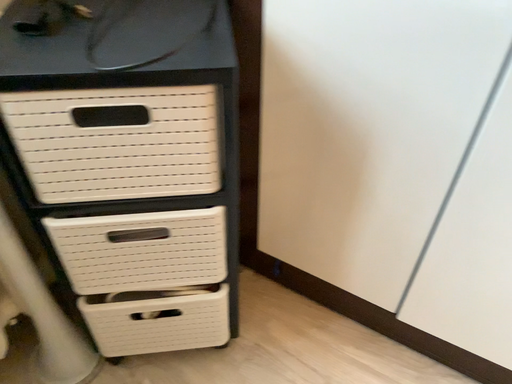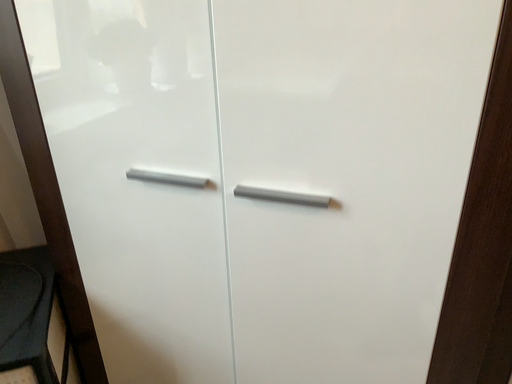
Question: Which way did the camera rotate in the video?

Choices:
 (A) rotated downward
 (B) rotated upward

Answer: (B)